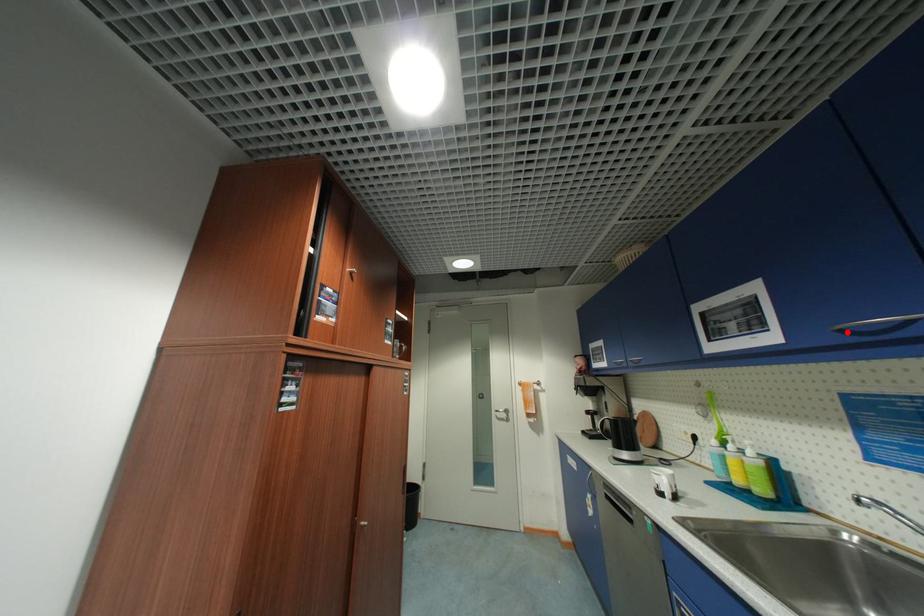
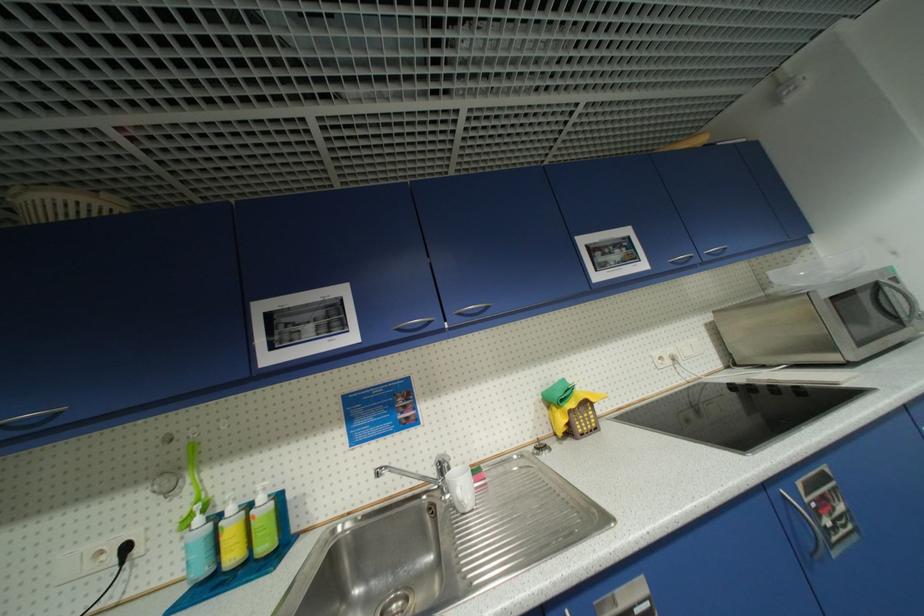
The point at the highlighted location is marked in the first image. Where is the corresponding point in the second image?

(405, 331)